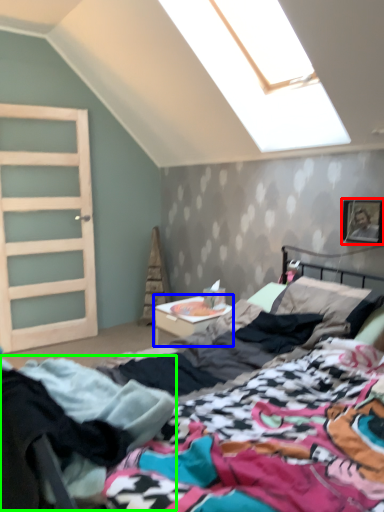
Question: Considering the real-world distances, which object is farthest from picture frame (highlighted by a red box)? nightstand (highlighted by a blue box) or clothing (highlighted by a green box)?

Choices:
 (A) nightstand
 (B) clothing

Answer: (B)